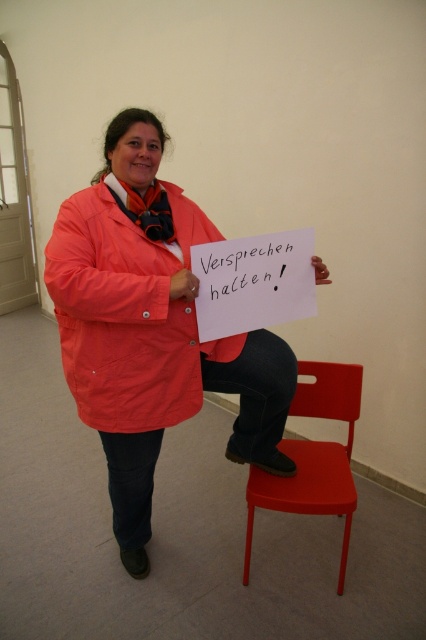
Who is shorter, matte nylon jacket at center or matte plastic chair at lower center?

matte plastic chair at lower center

Can you confirm if matte nylon jacket at center is positioned to the right of matte plastic chair at lower center?

In fact, matte nylon jacket at center is to the left of matte plastic chair at lower center.

Between point (285, 378) and point (250, 508), which one is positioned in front?

Point (285, 378) is in front.

Identify the location of matte nylon jacket at center. This screenshot has width=426, height=640. (150, 328).

Between matte nylon jacket at center and matte orange coat at center, which one has less height?

matte orange coat at center is shorter.

From the picture: Does matte nylon jacket at center have a smaller size compared to matte orange coat at center?

Incorrect, matte nylon jacket at center is not smaller in size than matte orange coat at center.

Does point (195, 410) come behind point (155, 355)?

Yes, it is behind point (155, 355).

Find the location of `matte nylon jacket at center`. matte nylon jacket at center is located at coordinates (150, 328).

Which is behind, point (97, 413) or point (345, 484)?

The point (345, 484) is behind.

Can you confirm if matte orange coat at center is positioned above matte plastic chair at lower center?

Yes, matte orange coat at center is above matte plastic chair at lower center.

This screenshot has height=640, width=426. Identify the location of matte orange coat at center. (127, 314).